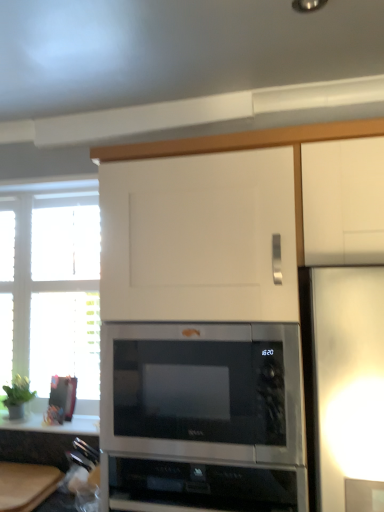
Question: Is white glossy countertop at lower left shorter than white wooden window at left?

Choices:
 (A) no
 (B) yes

Answer: (B)

Question: Considering the relative positions of white glossy countertop at lower left and white wooden window at left in the image provided, is white glossy countertop at lower left in front of white wooden window at left?

Choices:
 (A) no
 (B) yes

Answer: (B)

Question: Does white glossy countertop at lower left appear on the left side of white wooden window at left?

Choices:
 (A) no
 (B) yes

Answer: (A)

Question: Does white glossy countertop at lower left have a greater height compared to white wooden window at left?

Choices:
 (A) no
 (B) yes

Answer: (A)

Question: Is there a large distance between white glossy countertop at lower left and white wooden window at left?

Choices:
 (A) yes
 (B) no

Answer: (B)

Question: In terms of width, does white wooden window at left look wider or thinner when compared to black glass cooktop at lower center?

Choices:
 (A) wide
 (B) thin

Answer: (B)

Question: From the image's perspective, is white wooden window at left above or below black glass cooktop at lower center?

Choices:
 (A) above
 (B) below

Answer: (A)

Question: From a real-world perspective, relative to black glass cooktop at lower center, is white wooden window at left vertically above or below?

Choices:
 (A) below
 (B) above

Answer: (B)

Question: Is white wooden window at left taller or shorter than black glass cooktop at lower center?

Choices:
 (A) short
 (B) tall

Answer: (B)

Question: Is white wooden window at left inside the boundaries of white glossy countertop at lower left, or outside?

Choices:
 (A) inside
 (B) outside

Answer: (B)

Question: From a real-world perspective, is white wooden window at left positioned above or below white glossy countertop at lower left?

Choices:
 (A) below
 (B) above

Answer: (B)

Question: From the image's perspective, relative to white glossy countertop at lower left, is white wooden window at left above or below?

Choices:
 (A) below
 (B) above

Answer: (B)

Question: Considering the positions of point (64, 270) and point (59, 431), is point (64, 270) closer or farther from the camera than point (59, 431)?

Choices:
 (A) farther
 (B) closer

Answer: (A)

Question: Looking at the image, does white glossy countertop at lower left seem bigger or smaller compared to wooden cutting board at lower left?

Choices:
 (A) big
 (B) small

Answer: (B)

Question: Is white glossy countertop at lower left in front of or behind wooden cutting board at lower left in the image?

Choices:
 (A) front
 (B) behind

Answer: (B)